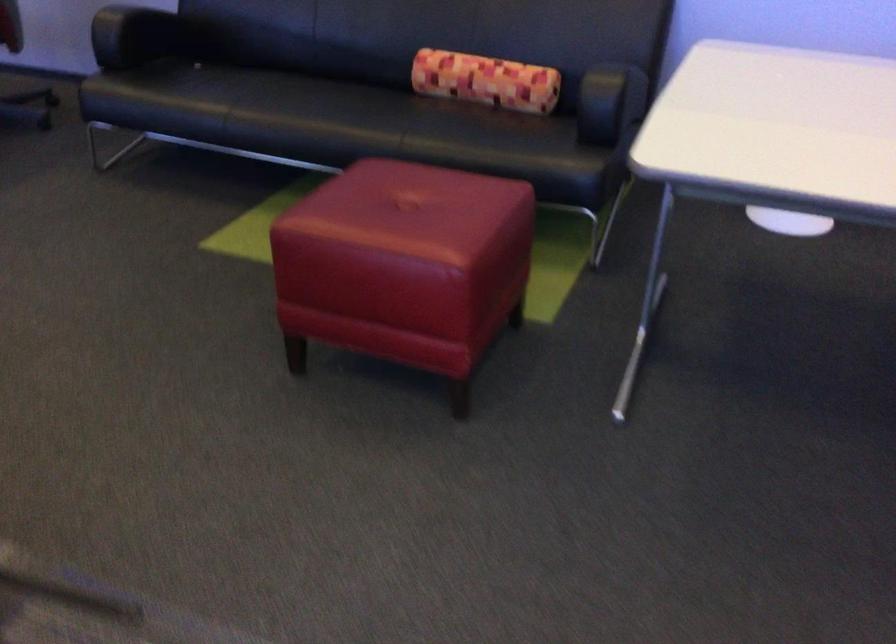
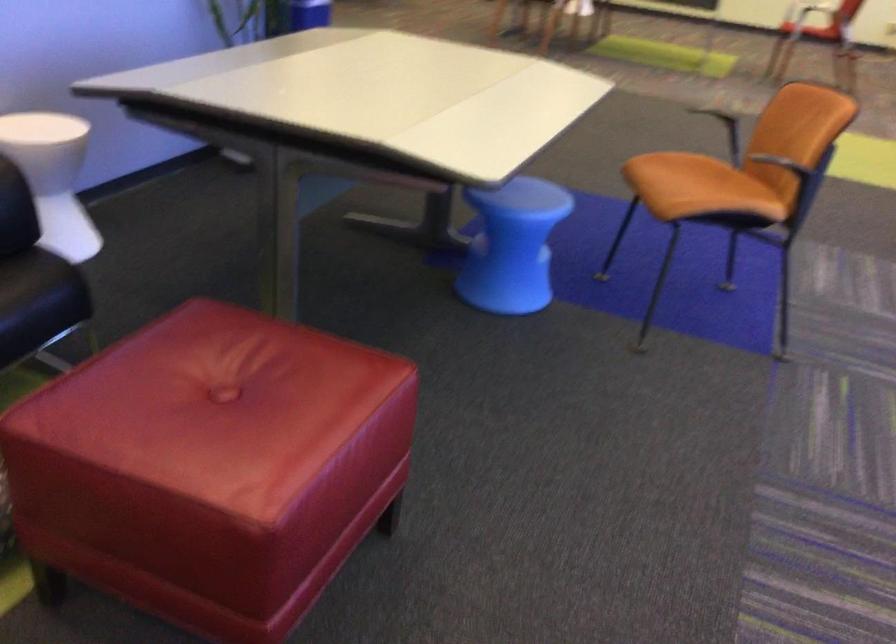
Find the pixel in the second image that matches [316,205] in the first image.

(211, 466)